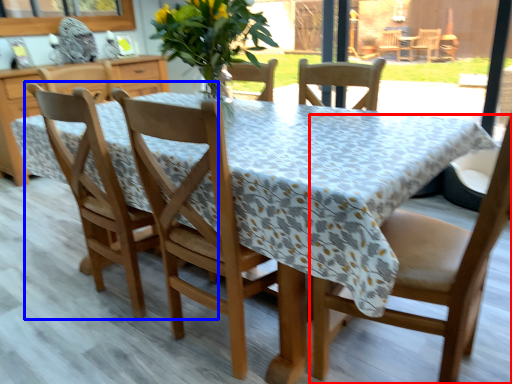
Question: Which object appears farthest to the camera in this image, chair (highlighted by a red box) or chair (highlighted by a blue box)?

Choices:
 (A) chair
 (B) chair

Answer: (B)